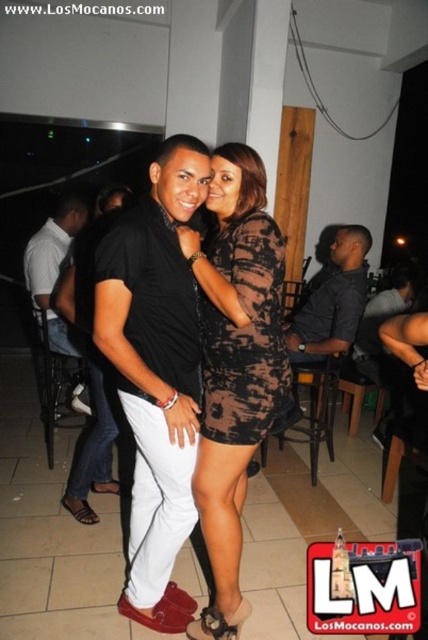
Does matte black shirt at center have a smaller size compared to black textured dress at center?

Actually, matte black shirt at center might be larger than black textured dress at center.

Is point (190, 272) positioned after point (238, 422)?

No.

Which is in front, point (195, 332) or point (255, 404)?

Point (255, 404)

The height and width of the screenshot is (640, 428). Identify the location of matte black shirt at center. (155, 372).

Is printed fabric dress at center positioned before dark gray textured shirt at center?

Yes, it is in front of dark gray textured shirt at center.

Which is above, printed fabric dress at center or dark gray textured shirt at center?

Positioned higher is dark gray textured shirt at center.

What do you see at coordinates (234, 365) in the screenshot? This screenshot has height=640, width=428. I see `printed fabric dress at center` at bounding box center [234, 365].

Identify the location of printed fabric dress at center. (234, 365).

Which of these two, black textured dress at center or dark gray textured shirt at center, stands taller?

Standing taller between the two is dark gray textured shirt at center.

Is point (261, 314) positioned after point (309, 312)?

No.

Is point (246, 339) more distant than point (323, 323)?

No, (246, 339) is closer to viewer.

Image resolution: width=428 pixels, height=640 pixels. Identify the location of black textured dress at center. (244, 333).